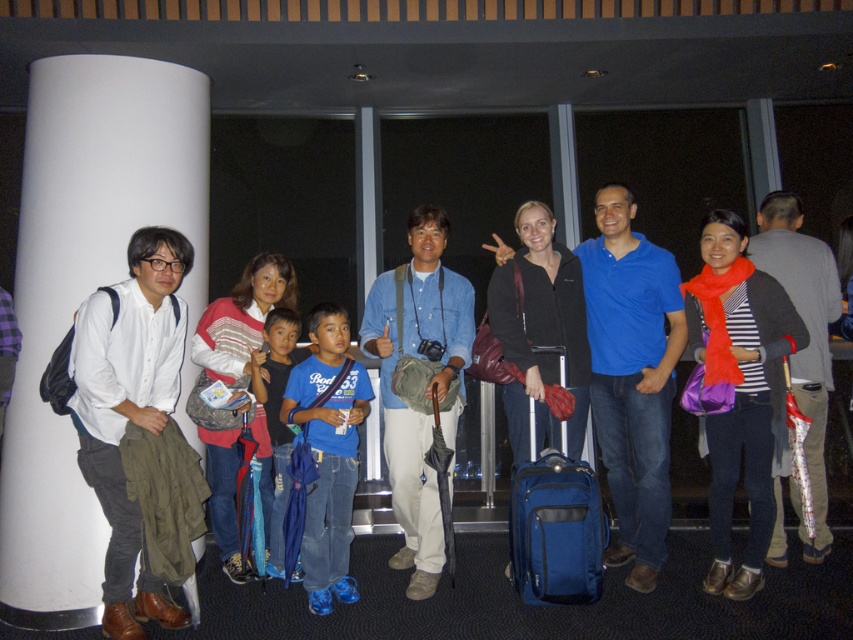
Question: Can you confirm if matte blue suitcase at center is positioned to the left of blue fabric suitcase at center?

Choices:
 (A) no
 (B) yes

Answer: (B)

Question: Which object is closer to the camera taking this photo?

Choices:
 (A) matte blue suitcase at center
 (B) blue denim jeans at center
 (C) blue fabric suitcase at center

Answer: (A)

Question: Can you confirm if blue denim jeans at center is positioned to the left of blue fabric suitcase at center?

Choices:
 (A) no
 (B) yes

Answer: (B)

Question: Which point appears closest to the camera in this image?

Choices:
 (A) (688, 534)
 (B) (535, 536)
 (C) (321, 371)

Answer: (B)

Question: Does matte blue suitcase at center lie behind blue fabric suitcase at center?

Choices:
 (A) no
 (B) yes

Answer: (A)

Question: Which object is closer to the camera taking this photo?

Choices:
 (A) blue fabric suitcase at center
 (B) blue denim jeans at center

Answer: (A)